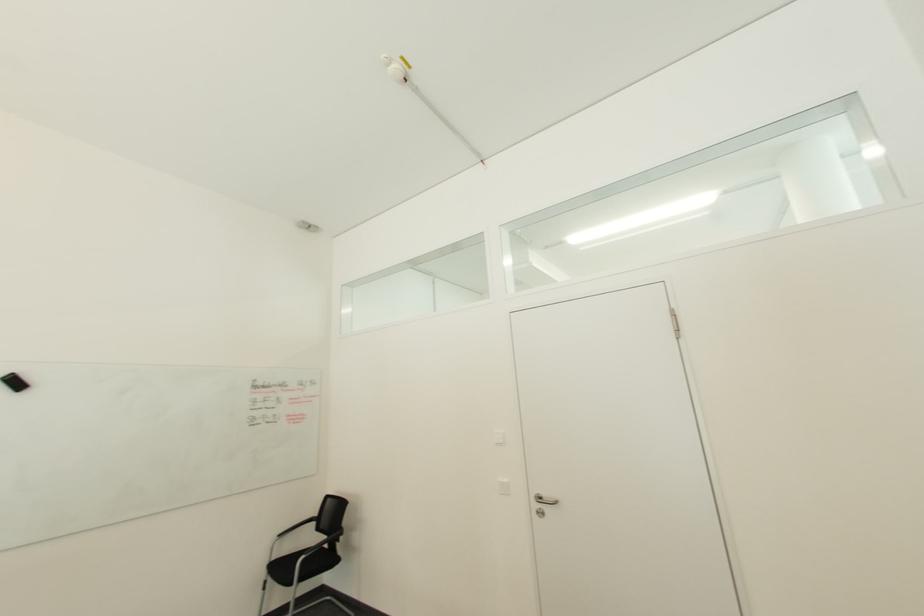
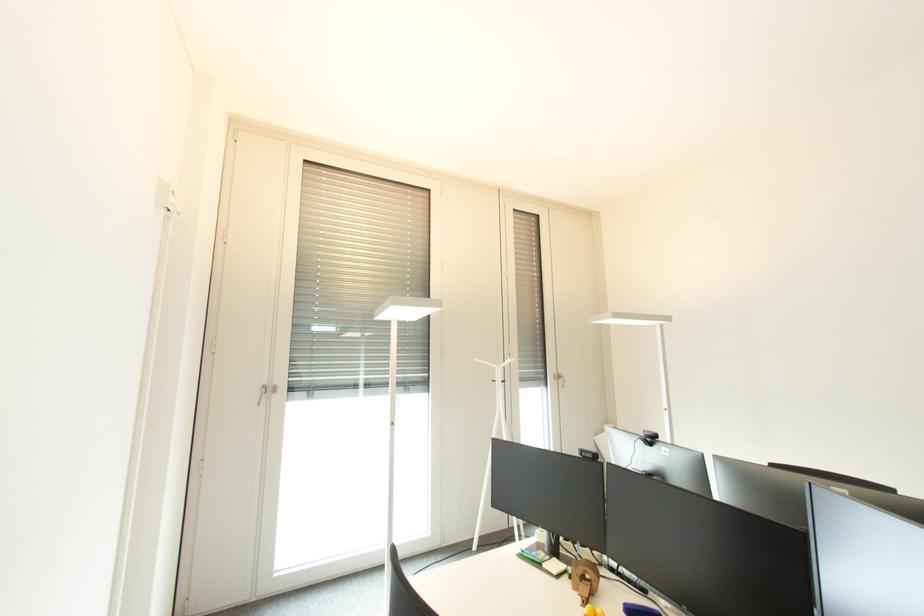
Question: Based on the continuous images, in which direction is the camera rotating? Reply with the corresponding letter.

Choices:
 (A) Left
 (B) Right
 (C) Up
 (D) Down

Answer: (A)